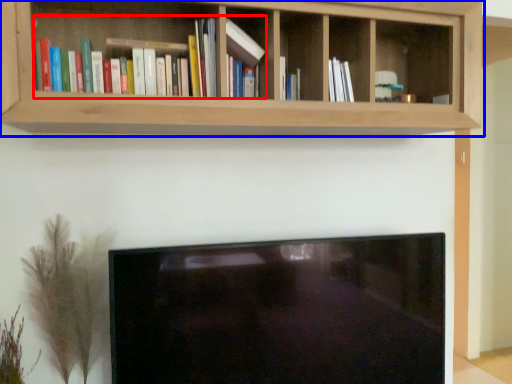
Question: Among these objects, which one is farthest to the camera, book (highlighted by a red box) or shelf (highlighted by a blue box)?

Choices:
 (A) book
 (B) shelf

Answer: (A)